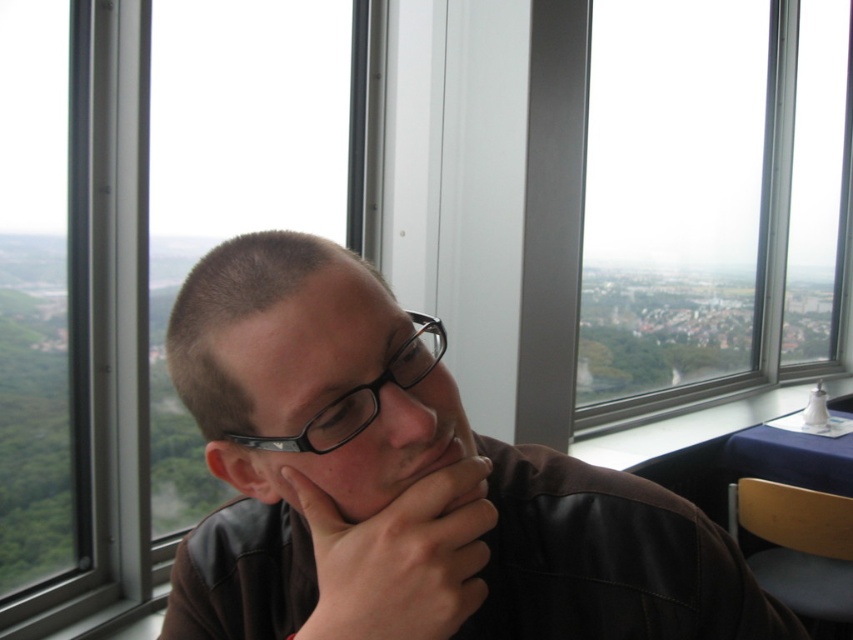
Question: Which object appears farthest from the camera in this image?

Choices:
 (A) matte black jacket at center
 (B) matte black jaw at center

Answer: (B)

Question: Which point is closer to the camera?

Choices:
 (A) (437, 460)
 (B) (184, 360)

Answer: (A)

Question: Does dark brown leather hand at center have a greater width compared to black plastic glasses at center?

Choices:
 (A) yes
 (B) no

Answer: (B)

Question: From the image, what is the correct spatial relationship of black plastic glasses at center in relation to matte black jaw at center?

Choices:
 (A) below
 (B) above

Answer: (B)

Question: Which object appears closest to the camera in this image?

Choices:
 (A) matte black jaw at center
 (B) black plastic glasses at center
 (C) dark brown leather hand at center

Answer: (C)

Question: Can you confirm if matte black jacket at center is wider than dark brown leather hand at center?

Choices:
 (A) no
 (B) yes

Answer: (B)